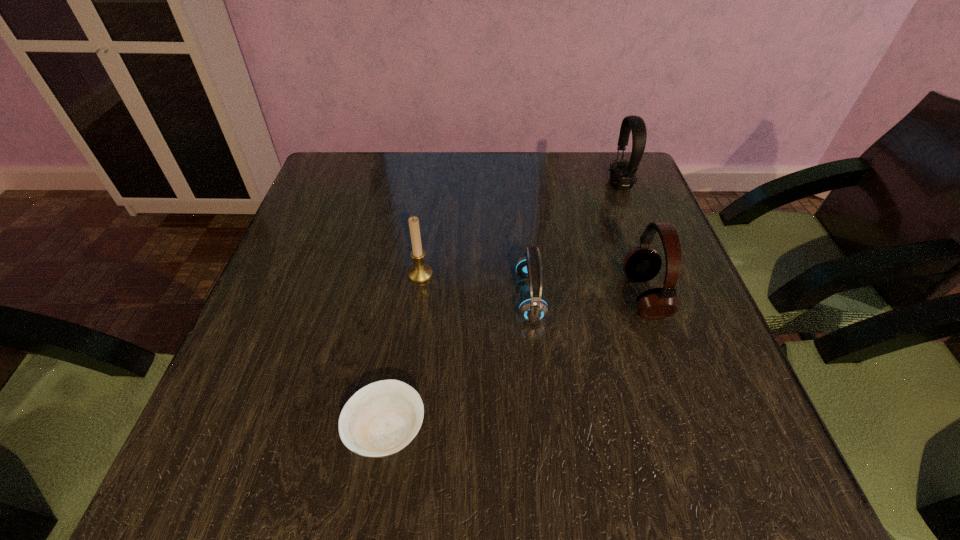
Image resolution: width=960 pixels, height=540 pixels. I want to click on object that ranks as the second closest to the fourth tallest object, so (419, 273).

Identify which object is the second nearest to the farthest object. Please provide its 2D coordinates. Your answer should be formatted as a tuple, i.e. [(x, y)], where the tuple contains the x and y coordinates of a point satisfying the conditions above.

[(533, 309)]

Identify the location of headset object that ranks as the second closest to the shortest headset. The height and width of the screenshot is (540, 960). (622, 173).

Select which headset is the third closest to the nearest object. Please provide its 2D coordinates. Your answer should be formatted as a tuple, i.e. [(x, y)], where the tuple contains the x and y coordinates of a point satisfying the conditions above.

[(622, 173)]